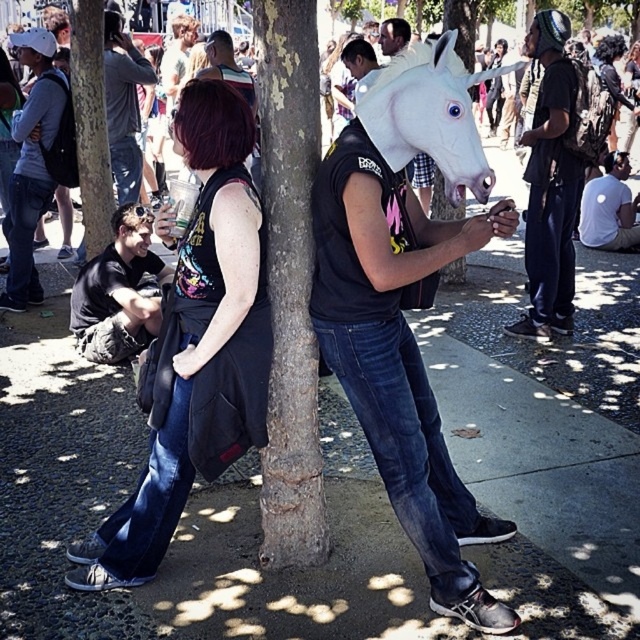
Measure the distance between black matte helmet at upper right and camera.

A distance of 4.44 meters exists between black matte helmet at upper right and camera.

Which of these two, black matte helmet at upper right or matte black hair at lower left, stands shorter?

With less height is matte black hair at lower left.

This screenshot has height=640, width=640. Identify the location of black matte helmet at upper right. (550, 184).

Can you confirm if vivid purple hair at center is positioned to the right of matte black hair at lower left?

Correct, you'll find vivid purple hair at center to the right of matte black hair at lower left.

Locate an element on the screen. The width and height of the screenshot is (640, 640). vivid purple hair at center is located at coordinates (212, 124).

Find the location of a particular element. Image resolution: width=640 pixels, height=640 pixels. vivid purple hair at center is located at coordinates (212, 124).

Between brown rough bark tree at center and matte black unicorn head at center, which one appears on the left side from the viewer's perspective?

brown rough bark tree at center

Is brown rough bark tree at center closer to camera compared to matte black unicorn head at center?

Yes, it is.

What do you see at coordinates (289, 282) in the screenshot?
I see `brown rough bark tree at center` at bounding box center [289, 282].

You are a GUI agent. You are given a task and a screenshot of the screen. Output one action in this format:
    pyautogui.click(x=<x>, y=<y>)
    Task: Click on the brown rough bark tree at center
    The image size is (640, 640).
    Given the screenshot: What is the action you would take?
    pyautogui.click(x=289, y=282)